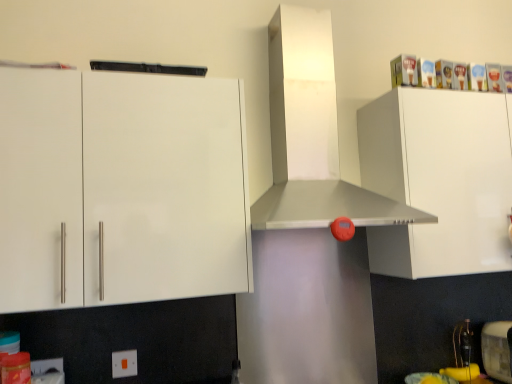
Question: Is metallic silver range hood at center taller than white glossy cabinet at upper right, which is counted as the first cabinetry, starting from the right?

Choices:
 (A) yes
 (B) no

Answer: (A)

Question: Is metallic silver range hood at center to the right of white glossy cabinet at upper right, which ranks as the 2th cabinetry in left-to-right order, from the viewer's perspective?

Choices:
 (A) yes
 (B) no

Answer: (B)

Question: Can you confirm if metallic silver range hood at center is thinner than white glossy cabinet at upper right, which ranks as the 2th cabinetry in left-to-right order?

Choices:
 (A) no
 (B) yes

Answer: (A)

Question: Is metallic silver range hood at center not near white glossy cabinet at upper right, which is counted as the first cabinetry, starting from the right?

Choices:
 (A) yes
 (B) no

Answer: (B)

Question: Does metallic silver range hood at center have a greater width compared to white glossy cabinet at upper right, which ranks as the 2th cabinetry in left-to-right order?

Choices:
 (A) no
 (B) yes

Answer: (B)

Question: Is white glossy cabinet at upper right, which ranks as the 2th cabinetry in left-to-right order, surrounded by metallic silver range hood at center?

Choices:
 (A) no
 (B) yes

Answer: (A)

Question: Considering the relative sizes of metallic silver range hood at center and white glossy cabinet at upper left, which ranks as the 2th cabinetry in right-to-left order, in the image provided, is metallic silver range hood at center shorter than white glossy cabinet at upper left, which ranks as the 2th cabinetry in right-to-left order,?

Choices:
 (A) yes
 (B) no

Answer: (B)

Question: Can white glossy cabinet at upper left, positioned as the 1th cabinetry in left-to-right order, be found inside metallic silver range hood at center?

Choices:
 (A) yes
 (B) no

Answer: (B)

Question: Is metallic silver range hood at center positioned with its back to white glossy cabinet at upper left, which ranks as the 2th cabinetry in right-to-left order?

Choices:
 (A) no
 (B) yes

Answer: (A)

Question: From the image's perspective, is metallic silver range hood at center over white glossy cabinet at upper left, which ranks as the 2th cabinetry in right-to-left order?

Choices:
 (A) yes
 (B) no

Answer: (A)

Question: Does metallic silver range hood at center turn towards white glossy cabinet at upper left, which ranks as the 2th cabinetry in right-to-left order?

Choices:
 (A) yes
 (B) no

Answer: (B)

Question: Does metallic silver range hood at center have a smaller size compared to white glossy cabinet at upper left, which ranks as the 2th cabinetry in right-to-left order?

Choices:
 (A) yes
 (B) no

Answer: (B)

Question: Is white glossy cabinet at upper right, which is counted as the first cabinetry, starting from the right, positioned beyond the bounds of metallic silver toaster at lower right?

Choices:
 (A) yes
 (B) no

Answer: (A)